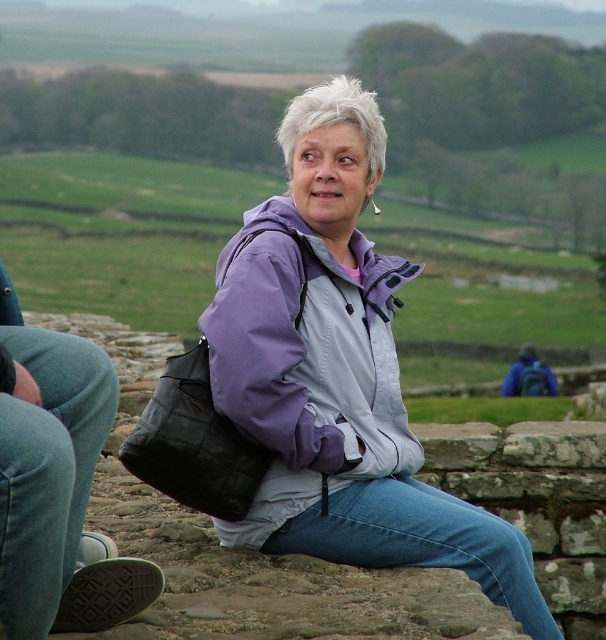
You are a fashion designer observing a person wearing two jackets. The person is sitting on a stone wall in a rural setting. Which jacket, the purple matte jacket at center or the purple softshell jacket at center, is positioned to the right of the other?

The purple matte jacket at center is to the right of the purple softshell jacket at center.

You are a photographer trying to capture a candid shot of the person in the scene. You need to ensure that both the purple matte jacket at center and the purple softshell jacket at center are in focus simultaneously. Given that your camera has a depth of field that can cover 4 feet, will you be able to achieve this?

The distance between the purple matte jacket at center and purple softshell jacket at center is 4.57 feet. Since your camera can only cover 4 feet, you won